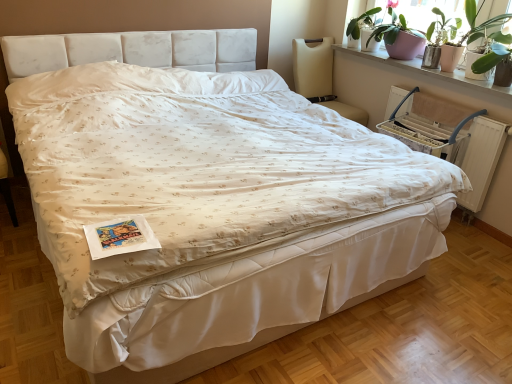
This screenshot has height=384, width=512. What do you see at coordinates (430, 71) in the screenshot?
I see `matte white window sill at upper right` at bounding box center [430, 71].

Where is `matte white window sill at upper right`? This screenshot has height=384, width=512. matte white window sill at upper right is located at coordinates (430, 71).

Considering the relative sizes of matte white window screen at upper right and green leafy plant at upper right in the image provided, is matte white window screen at upper right taller than green leafy plant at upper right?

Yes, matte white window screen at upper right is taller than green leafy plant at upper right.

Can you confirm if matte white window screen at upper right is wider than green leafy plant at upper right?

Yes, matte white window screen at upper right is wider than green leafy plant at upper right.

From the image's perspective, which is below, matte white window screen at upper right or green leafy plant at upper right?

green leafy plant at upper right, from the image's perspective.

Which object is positioned more to the right, matte white window screen at upper right or green leafy plant at upper right?

Positioned to the right is green leafy plant at upper right.

From the image's perspective, is beige fabric chair at upper right positioned above or below green leafy plant at upper right?

beige fabric chair at upper right is above green leafy plant at upper right.

Considering the sizes of objects beige fabric chair at upper right and green leafy plant at upper right in the image provided, who is wider, beige fabric chair at upper right or green leafy plant at upper right?

beige fabric chair at upper right is wider.

Are beige fabric chair at upper right and green leafy plant at upper right far apart?

beige fabric chair at upper right is positioned a significant distance from green leafy plant at upper right.

At what (x,y) coordinates should I click in order to perform the action: click on chair on the left of green leafy plant at upper right. Please return your answer as a coordinate pair (x, y). The image size is (512, 384). Looking at the image, I should click on (320, 76).

From the picture: Considering the sizes of objects matte white window screen at upper right and beige fabric chair at upper right in the image provided, who is smaller, matte white window screen at upper right or beige fabric chair at upper right?

matte white window screen at upper right is smaller.

From a real-world perspective, is matte white window screen at upper right located beneath beige fabric chair at upper right?

No.

Which is more to the right, matte white window screen at upper right or beige fabric chair at upper right?

matte white window screen at upper right is more to the right.

Considering the sizes of objects beige fabric chair at upper right and matte white window sill at upper right in the image provided, who is smaller, beige fabric chair at upper right or matte white window sill at upper right?

matte white window sill at upper right.

Which object is thinner, beige fabric chair at upper right or matte white window sill at upper right?

matte white window sill at upper right.

Considering the positions of objects beige fabric chair at upper right and matte white window sill at upper right in the image provided, who is in front, beige fabric chair at upper right or matte white window sill at upper right?

Positioned in front is matte white window sill at upper right.

Is beige fabric chair at upper right aimed at matte white window sill at upper right?

Yes, beige fabric chair at upper right is turned towards matte white window sill at upper right.

From the image's perspective, which one is positioned higher, green leafy plant at upper right or matte white window screen at upper right?

matte white window screen at upper right is shown above in the image.

Considering the sizes of green leafy plant at upper right and matte white window screen at upper right in the image, is green leafy plant at upper right wider or thinner than matte white window screen at upper right?

green leafy plant at upper right is thinner than matte white window screen at upper right.

Based on the photo, is green leafy plant at upper right facing towards matte white window screen at upper right?

No, green leafy plant at upper right is not aimed at matte white window screen at upper right.

Is beige fabric chair at upper right turned away from matte white window screen at upper right?

beige fabric chair at upper right is not turned away from matte white window screen at upper right.

From the image's perspective, is beige fabric chair at upper right over matte white window screen at upper right?

No, from the image's perspective, beige fabric chair at upper right is not above matte white window screen at upper right.

Considering the sizes of objects beige fabric chair at upper right and matte white window screen at upper right in the image provided, who is thinner, beige fabric chair at upper right or matte white window screen at upper right?

matte white window screen at upper right is thinner.

Considering the relative sizes of beige fabric chair at upper right and matte white window screen at upper right in the image provided, is beige fabric chair at upper right shorter than matte white window screen at upper right?

In fact, beige fabric chair at upper right may be taller than matte white window screen at upper right.

Which object is further away from the camera taking this photo, matte white window sill at upper right or beige fabric chair at upper right?

beige fabric chair at upper right is more distant.

Is matte white window sill at upper right spatially inside beige fabric chair at upper right, or outside of it?

The correct answer is: outside.

Which object is positioned more to the left, matte white window sill at upper right or beige fabric chair at upper right?

beige fabric chair at upper right is more to the left.

Is point (415, 61) farther from camera compared to point (316, 63)?

That is False.

The width and height of the screenshot is (512, 384). In order to click on window screen on the left of green leafy plant at upper right in this screenshot , I will do `click(426, 14)`.

At what (x,y) coordinates should I click in order to perform the action: click on chair above the green leafy plant at upper right (from the image's perspective). Please return your answer as a coordinate pair (x, y). Image resolution: width=512 pixels, height=384 pixels. Looking at the image, I should click on (320, 76).

Which object lies further to the anchor point matte white window screen at upper right, green leafy plant at upper right or beige fabric chair at upper right?

beige fabric chair at upper right is positioned further to the anchor matte white window screen at upper right.

Which object lies further to the anchor point beige fabric chair at upper right, matte white window sill at upper right or green leafy plant at upper right?

green leafy plant at upper right lies further to beige fabric chair at upper right than the other object.

Which object lies nearer to the anchor point matte white window sill at upper right, green leafy plant at upper right or beige fabric chair at upper right?

green leafy plant at upper right is closer to matte white window sill at upper right.

Based on their spatial positions, is matte white window sill at upper right or matte white window screen at upper right further from green leafy plant at upper right?

matte white window sill at upper right is positioned further to the anchor green leafy plant at upper right.

When comparing their distances from matte white window screen at upper right, does matte white window sill at upper right or green leafy plant at upper right seem closer?

Based on the image, green leafy plant at upper right appears to be nearer to matte white window screen at upper right.

From the image, which object appears to be farther from beige fabric chair at upper right, matte white window screen at upper right or green leafy plant at upper right?

The object further to beige fabric chair at upper right is green leafy plant at upper right.

Considering their positions, is matte white window screen at upper right positioned further to beige fabric chair at upper right than matte white window sill at upper right?

matte white window screen at upper right lies further to beige fabric chair at upper right than the other object.

When comparing their distances from matte white window sill at upper right, does matte white window screen at upper right or green leafy plant at upper right seem closer?

Based on the image, green leafy plant at upper right appears to be nearer to matte white window sill at upper right.

Where is `window sill between beige fabric chair at upper right and green leafy plant at upper right`? window sill between beige fabric chair at upper right and green leafy plant at upper right is located at coordinates (430, 71).

Identify the location of window screen between matte white window sill at upper right and green leafy plant at upper right from left to right. (426, 14).

The height and width of the screenshot is (384, 512). I want to click on window screen between beige fabric chair at upper right and green leafy plant at upper right in the horizontal direction, so click(426, 14).

Image resolution: width=512 pixels, height=384 pixels. Find the location of `window sill located between beige fabric chair at upper right and matte white window screen at upper right in the left-right direction`. window sill located between beige fabric chair at upper right and matte white window screen at upper right in the left-right direction is located at coordinates (430, 71).